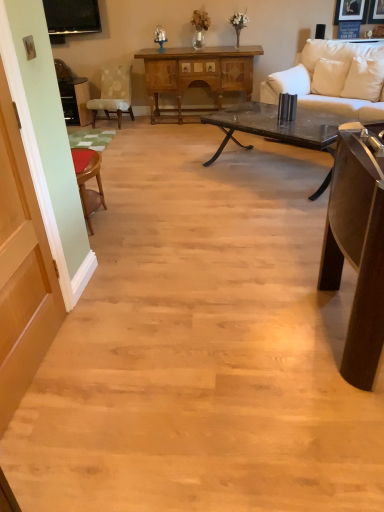
Question: Considering the positions of black glass coffee table at center and white leather couch at upper right in the image, is black glass coffee table at center taller or shorter than white leather couch at upper right?

Choices:
 (A) short
 (B) tall

Answer: (A)

Question: From the image's perspective, relative to white leather couch at upper right, is black glass coffee table at center above or below?

Choices:
 (A) below
 (B) above

Answer: (A)

Question: Considering the real-world distances, which object is farthest from the light beige fabric chair at left?

Choices:
 (A) white leather couch at upper right
 (B) black glass coffee table at center
 (C) white fabric pillow at right, the 1th pillow viewed from the left
 (D) brown wooden table at left, which ranks as the second table in top-to-bottom order
 (E) white leather pillow at upper right, which ranks as the 1th pillow in right-to-left order

Answer: (E)

Question: Which object is positioned closest to the wooden cabinet at center, the third table ordered from the bottom?

Choices:
 (A) dark brown wood table at right, acting as the first table starting from the bottom
 (B) white leather couch at upper right
 (C) light beige fabric chair at left
 (D) white leather pillow at upper right, which ranks as the 1th pillow in right-to-left order
 (E) white fabric pillow at right, the 1th pillow viewed from the left

Answer: (C)